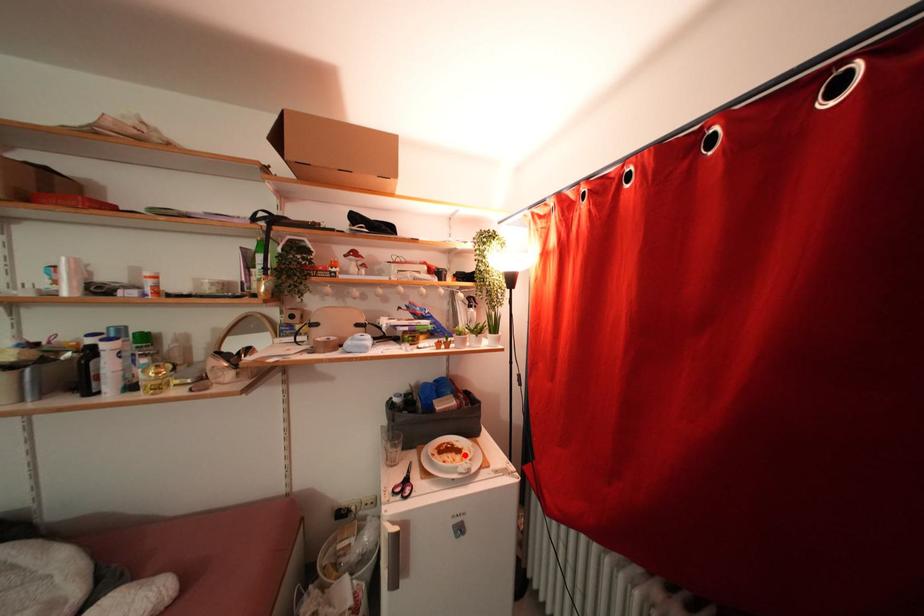
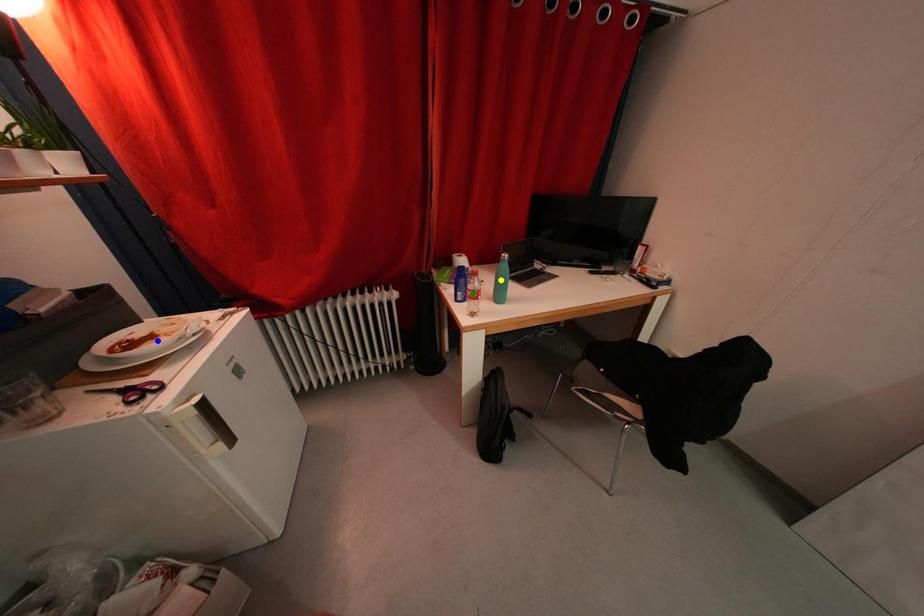
Question: I am providing you with two images of the same scene from different viewpoints. A red point is marked on the first image. You are given multiple points on the second image. Which mark in image 2 goes with the point in image 1?

Choices:
 (A) blue point
 (B) yellow point
 (C) green point

Answer: (A)